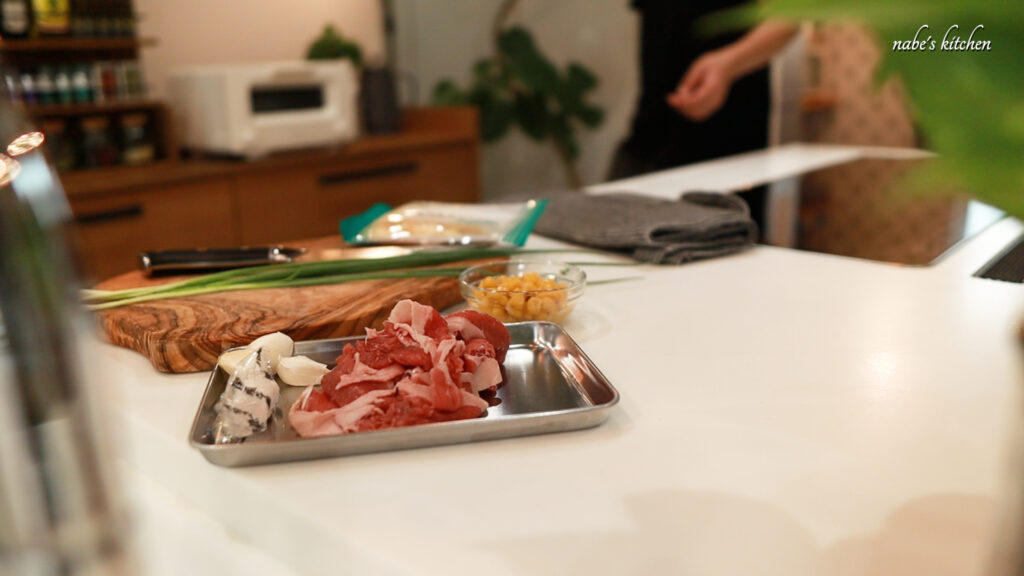
At what (x,y) coordinates should I click in order to perform the action: click on clear glass bowl. Please return your answer as a coordinate pair (x, y). Looking at the image, I should click on (518, 303).